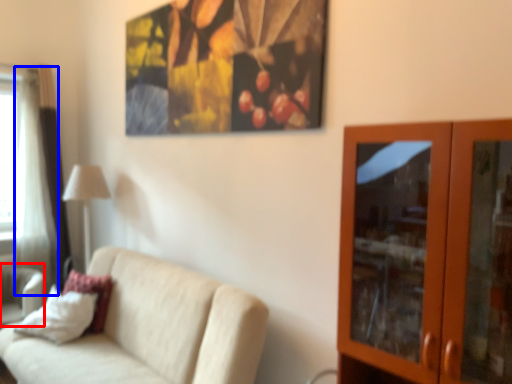
Question: Which point is closer to the camera, swivel chair (highlighted by a red box) or curtain (highlighted by a blue box)?

Choices:
 (A) swivel chair
 (B) curtain

Answer: (A)